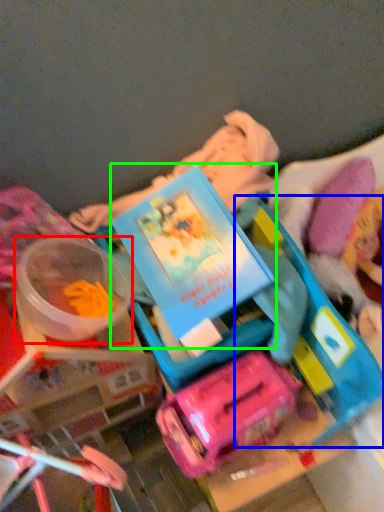
Question: Estimate the real-world distances between objects in this image. Which object is closer to toy (highlighted by a red box), toy (highlighted by a blue box) or book (highlighted by a green box)?

Choices:
 (A) toy
 (B) book

Answer: (B)